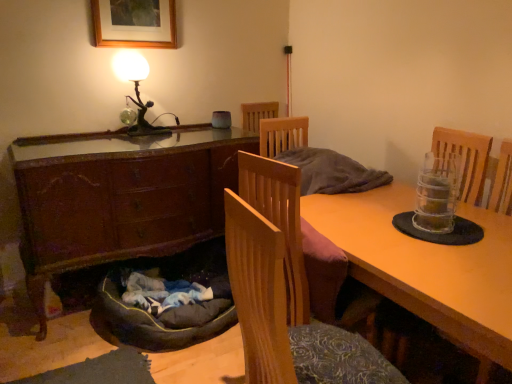
Question: Is wooden desk at center positioned before metallic figure at upper left?

Choices:
 (A) no
 (B) yes

Answer: (B)

Question: Considering the relative sizes of wooden desk at center and metallic figure at upper left in the image provided, is wooden desk at center wider than metallic figure at upper left?

Choices:
 (A) no
 (B) yes

Answer: (B)

Question: From a real-world perspective, is wooden desk at center over metallic figure at upper left?

Choices:
 (A) no
 (B) yes

Answer: (A)

Question: Is wooden desk at center facing towards metallic figure at upper left?

Choices:
 (A) no
 (B) yes

Answer: (A)

Question: Is wooden desk at center completely or partially outside of metallic figure at upper left?

Choices:
 (A) no
 (B) yes

Answer: (B)

Question: From a real-world perspective, does wooden desk at center sit lower than metallic figure at upper left?

Choices:
 (A) no
 (B) yes

Answer: (B)

Question: From the image's perspective, would you say wooden chair at center is positioned over dark gray fabric dog bed at lower left?

Choices:
 (A) no
 (B) yes

Answer: (B)

Question: Is wooden chair at center wider than dark gray fabric dog bed at lower left?

Choices:
 (A) no
 (B) yes

Answer: (A)

Question: Does wooden chair at center come in front of dark gray fabric dog bed at lower left?

Choices:
 (A) yes
 (B) no

Answer: (A)

Question: Can we say wooden chair at center lies outside dark gray fabric dog bed at lower left?

Choices:
 (A) no
 (B) yes

Answer: (B)

Question: Is dark gray fabric dog bed at lower left inside wooden chair at center?

Choices:
 (A) no
 (B) yes

Answer: (A)

Question: Is wooden chair at center at the right side of dark gray fabric dog bed at lower left?

Choices:
 (A) no
 (B) yes

Answer: (B)

Question: Can you confirm if wooden desk at center is thinner than wooden chair at center?

Choices:
 (A) no
 (B) yes

Answer: (A)